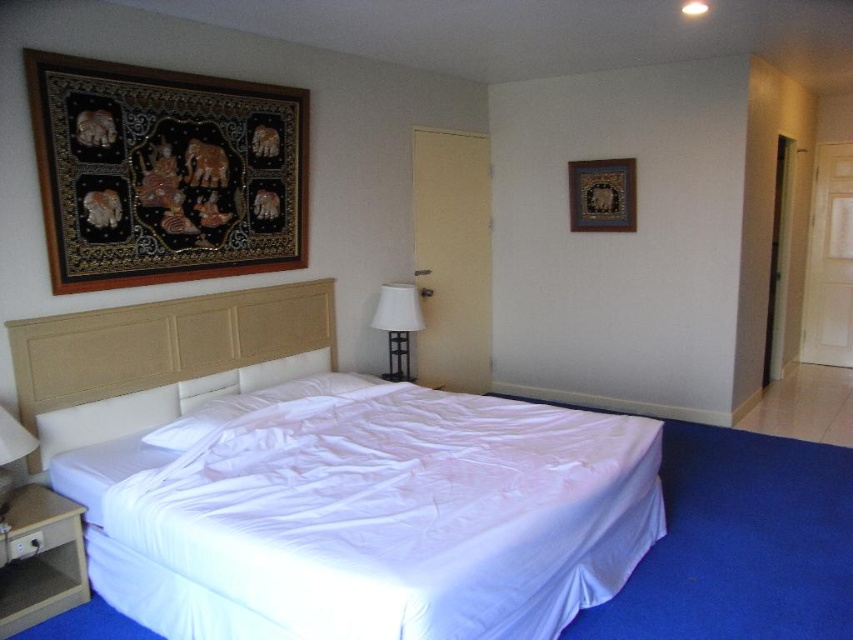
You are standing in the hotel room and want to place a small lamp on the nightstand closest to the white fabric bed at center. Which side of the bed should you go to if the black fabric tapestry at upper left is on your left when facing the bed?

Since the white fabric bed at center is to the right of the black fabric tapestry at upper left, the nightstand on the left side of the bed is closer to the tapestry. Therefore, to place the lamp on the nightstand nearest the white fabric bed at center, you should go to the right side of the bed.

Based on the photo, you are standing in the hotel room and need to locate the white fabric bed at center. What are the coordinates where you should look?

The white fabric bed at center is located at coordinates point (366, 515).

You are a hotel guest who wants to hang a small painting between the white fabric bed at center and the white fabric lampshade at center. Can you do this without moving either object?

The white fabric bed at center is located below the white fabric lampshade at center, so there is space between them to hang a small painting without moving either object.